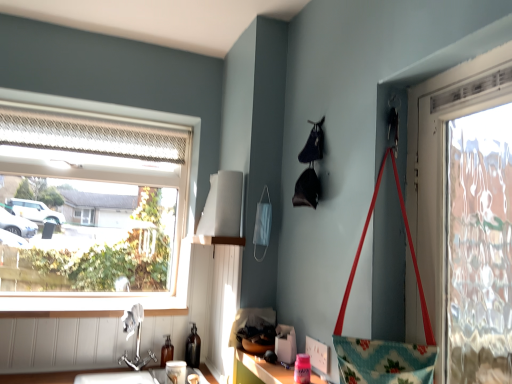
The height and width of the screenshot is (384, 512). What do you see at coordinates (265, 368) in the screenshot?
I see `pink plastic container at lower center` at bounding box center [265, 368].

Locate an element on the screen. The image size is (512, 384). silver metallic faucet at lower left is located at coordinates (136, 337).

The height and width of the screenshot is (384, 512). What do you see at coordinates (166, 351) in the screenshot?
I see `translucent glass bottle at lower center, placed as the second bottle when sorted from right to left` at bounding box center [166, 351].

Where is `matte glass bottle at lower left, which is counted as the second bottle, starting from the left`? matte glass bottle at lower left, which is counted as the second bottle, starting from the left is located at coordinates (193, 348).

Locate an element on the screen. The width and height of the screenshot is (512, 384). pink plastic container at lower center is located at coordinates (265, 368).

Is white plastic power outlet at lower center inside or outside of floral fabric handbag at right?

white plastic power outlet at lower center exists outside the volume of floral fabric handbag at right.

Is white plastic power outlet at lower center oriented away from floral fabric handbag at right?

That's not correct — white plastic power outlet at lower center is not looking away from floral fabric handbag at right.

From the image's perspective, which one is positioned higher, white plastic power outlet at lower center or floral fabric handbag at right?

floral fabric handbag at right.

From a real-world perspective, is white plastic power outlet at lower center physically located above or below floral fabric handbag at right?

In terms of real-world spatial position, white plastic power outlet at lower center is below floral fabric handbag at right.

Between clear glass window at upper left and white fabric lampshade at upper center, which one is positioned in front?

white fabric lampshade at upper center is more forward.

Is clear glass window at upper left facing towards white fabric lampshade at upper center?

Yes, clear glass window at upper left is aimed at white fabric lampshade at upper center.

Consider the image. Which is farther from the camera, (156, 123) or (200, 221)?

Positioned behind is point (156, 123).

How different are the orientations of clear glass window at upper left and white fabric lampshade at upper center in degrees?

The angle between the facing direction of clear glass window at upper left and the facing direction of white fabric lampshade at upper center is 91 degrees.

Measure the distance between matte white cup at lower center and silver metallic faucet at lower left.

matte white cup at lower center and silver metallic faucet at lower left are 11.53 inches apart from each other.

Identify the location of faucet in front of the matte white cup at lower center. This screenshot has height=384, width=512. point(136,337).

Based on the photo, does matte white cup at lower center have a lesser height compared to silver metallic faucet at lower left?

Indeed, matte white cup at lower center has a lesser height compared to silver metallic faucet at lower left.

From a real-world perspective, is matte white cup at lower center positioned above or below silver metallic faucet at lower left?

matte white cup at lower center is situated lower than silver metallic faucet at lower left in the real world.

Can you confirm if matte glass bottle at lower left, which is counted as the second bottle, starting from the left, is positioned to the left of translucent glass bottle at lower center, the 1th bottle in the left-to-right sequence?

In fact, matte glass bottle at lower left, which is counted as the second bottle, starting from the left, is to the right of translucent glass bottle at lower center, the 1th bottle in the left-to-right sequence.

Which object is wider, matte glass bottle at lower left, which is counted as the second bottle, starting from the left, or translucent glass bottle at lower center, placed as the second bottle when sorted from right to left?

With larger width is matte glass bottle at lower left, which is counted as the second bottle, starting from the left.

Does matte glass bottle at lower left, the 1th bottle from the right, have a lesser height compared to translucent glass bottle at lower center, the 1th bottle in the left-to-right sequence?

Incorrect, the height of matte glass bottle at lower left, the 1th bottle from the right, does not fall short of that of translucent glass bottle at lower center, the 1th bottle in the left-to-right sequence.

Is matte glass bottle at lower left, which is counted as the second bottle, starting from the left, in front of or behind translucent glass bottle at lower center, the 1th bottle in the left-to-right sequence, in the image?

In the image, matte glass bottle at lower left, which is counted as the second bottle, starting from the left, appears behind translucent glass bottle at lower center, the 1th bottle in the left-to-right sequence.

Is white plastic power outlet at lower center outside of clear glass window at upper left?

Yes, white plastic power outlet at lower center is not within clear glass window at upper left.

Considering the relative sizes of white plastic power outlet at lower center and clear glass window at upper left in the image provided, is white plastic power outlet at lower center bigger than clear glass window at upper left?

Incorrect, white plastic power outlet at lower center is not larger than clear glass window at upper left.

Is point (306, 346) positioned behind point (67, 126)?

No, (306, 346) is closer to viewer.

Is white plastic power outlet at lower center to the left of clear glass window at upper left from the viewer's perspective?

In fact, white plastic power outlet at lower center is to the right of clear glass window at upper left.

Considering the relative sizes of white fabric lampshade at upper center and silver metallic faucet at lower left in the image provided, is white fabric lampshade at upper center thinner than silver metallic faucet at lower left?

Correct, the width of white fabric lampshade at upper center is less than that of silver metallic faucet at lower left.

Locate an element on the screen. lampshade on the right of the silver metallic faucet at lower left is located at coordinates (222, 205).

Is white fabric lampshade at upper center facing away from silver metallic faucet at lower left?

white fabric lampshade at upper center is not turned away from silver metallic faucet at lower left.

Which object is closer to the camera, white fabric lampshade at upper center or silver metallic faucet at lower left?

Positioned in front is white fabric lampshade at upper center.

Considering the sizes of objects pink plastic container at lower center and silver metallic faucet at lower left in the image provided, who is bigger, pink plastic container at lower center or silver metallic faucet at lower left?

silver metallic faucet at lower left is bigger.

Is point (262, 364) farther from camera compared to point (128, 325)?

No, it is in front of (128, 325).

Is pink plastic container at lower center closer to camera compared to silver metallic faucet at lower left?

That is True.

How many degrees apart are the facing directions of pink plastic container at lower center and silver metallic faucet at lower left?

The angle between the facing direction of pink plastic container at lower center and the facing direction of silver metallic faucet at lower left is 90.1 degrees.

Image resolution: width=512 pixels, height=384 pixels. Identify the location of handbag on the right of white plastic power outlet at lower center. (380, 340).

This screenshot has width=512, height=384. There is a white fabric lampshade at upper center. What are the coordinates of `window above it (from a real-world perspective)` in the screenshot? It's located at (98, 198).

Considering their positions, is floral fabric handbag at right positioned further to translucent glass bottle at lower center, placed as the second bottle when sorted from right to left, than white plastic power outlet at lower center?

Based on the image, floral fabric handbag at right appears to be further to translucent glass bottle at lower center, placed as the second bottle when sorted from right to left.

From the image, which object appears to be farther from matte white cup at lower center, pink plastic container at lower center or clear glass window at upper left?

Based on the image, clear glass window at upper left appears to be further to matte white cup at lower center.

Considering their positions, is floral fabric handbag at right positioned further to translucent glass bottle at lower center, placed as the second bottle when sorted from right to left, than matte glass bottle at lower left, the 1th bottle from the right?

floral fabric handbag at right is further to translucent glass bottle at lower center, placed as the second bottle when sorted from right to left.

From the image, which object appears to be farther from silver metallic faucet at lower left, matte white cup at lower center or white fabric lampshade at upper center?

Based on the image, white fabric lampshade at upper center appears to be further to silver metallic faucet at lower left.

Based on their spatial positions, is white fabric lampshade at upper center or floral fabric handbag at right closer to silver metallic faucet at lower left?

white fabric lampshade at upper center.

Considering their positions, is clear glass window at upper left positioned further to translucent glass bottle at lower center, the 1th bottle in the left-to-right sequence, than matte glass bottle at lower left, the 1th bottle from the right?

clear glass window at upper left is further to translucent glass bottle at lower center, the 1th bottle in the left-to-right sequence.

Based on their spatial positions, is translucent glass bottle at lower center, the 1th bottle in the left-to-right sequence, or white fabric lampshade at upper center further from matte glass bottle at lower left, the 1th bottle from the right?

Among the two, white fabric lampshade at upper center is located further to matte glass bottle at lower left, the 1th bottle from the right.

Which object lies further to the anchor point matte glass bottle at lower left, which is counted as the second bottle, starting from the left, silver metallic faucet at lower left or matte white cup at lower center?

Among the two, silver metallic faucet at lower left is located further to matte glass bottle at lower left, which is counted as the second bottle, starting from the left.

Identify the location of faucet between white fabric lampshade at upper center and pink plastic container at lower center from top to bottom. (136, 337).

You are a GUI agent. You are given a task and a screenshot of the screen. Output one action in this format:
    pyautogui.click(x=<x>, y=<y>)
    Task: Click on the power outlet between pink plastic container at lower center and matte glass bottle at lower left, which is counted as the second bottle, starting from the left, from front to back
    
    Given the screenshot: What is the action you would take?
    (x=318, y=354)

Image resolution: width=512 pixels, height=384 pixels. Find the location of `lampshade situated between clear glass window at upper left and pink plastic container at lower center from left to right`. lampshade situated between clear glass window at upper left and pink plastic container at lower center from left to right is located at coordinates (222, 205).

Image resolution: width=512 pixels, height=384 pixels. I want to click on faucet between clear glass window at upper left and matte white cup at lower center vertically, so click(x=136, y=337).